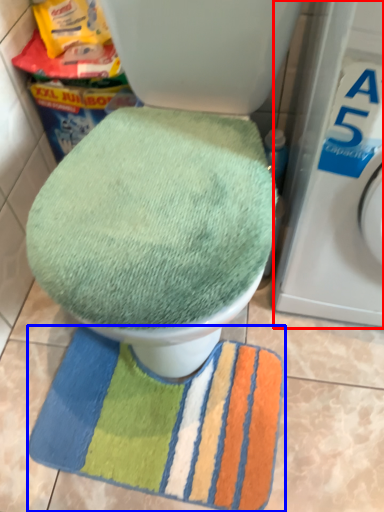
Question: Which object appears closest to the camera in this image, washing machine (highlighted by a red box) or beach towel (highlighted by a blue box)?

Choices:
 (A) washing machine
 (B) beach towel

Answer: (A)